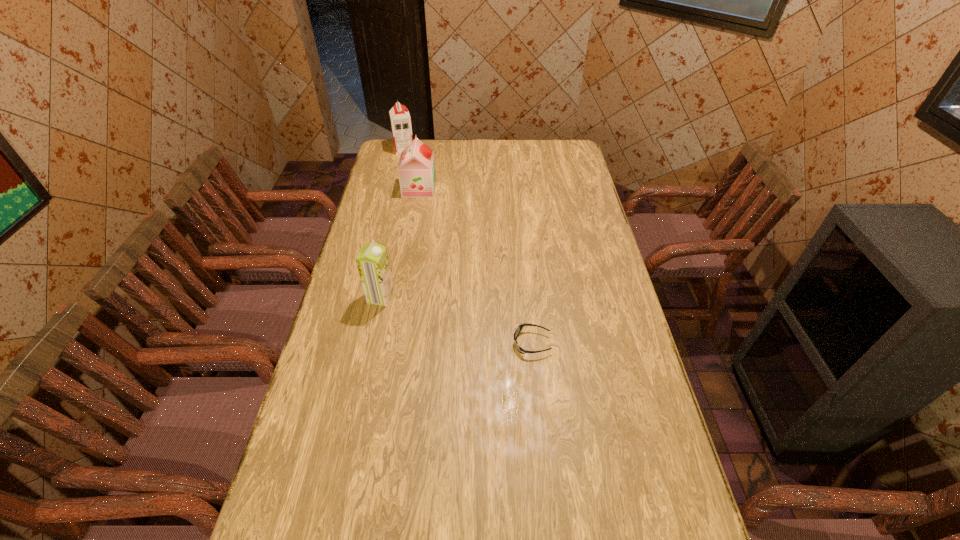
Find the location of a particular element. the farthest soya milk is located at coordinates (400, 119).

Locate an element on the screen. This screenshot has height=540, width=960. the third nearest object is located at coordinates (417, 176).

You are a GUI agent. You are given a task and a screenshot of the screen. Output one action in this format:
    pyautogui.click(x=<x>, y=<y>)
    Task: Click on the nearest soya milk
    
    Given the screenshot: What is the action you would take?
    pyautogui.click(x=372, y=261)

At what (x,y) coordinates should I click in order to perform the action: click on the shortest object. Please return your answer as a coordinate pair (x, y). Looking at the image, I should click on (519, 328).

The image size is (960, 540). I want to click on sunglasses, so click(519, 328).

Find the location of a particular element. This screenshot has width=960, height=540. free location located 0.120m on the front of the farthest soya milk is located at coordinates (399, 168).

In order to click on blank area located 0.340m with the cap open on the second farthest object in this screenshot , I will do `click(514, 188)`.

Where is `free space located 0.300m on the right of the second nearest object`? This screenshot has width=960, height=540. free space located 0.300m on the right of the second nearest object is located at coordinates click(484, 297).

The width and height of the screenshot is (960, 540). Identify the location of free space located on the lenses of the sunglasses. (383, 343).

The image size is (960, 540). I want to click on free location located 0.050m on the lenses of the sunglasses, so click(496, 343).